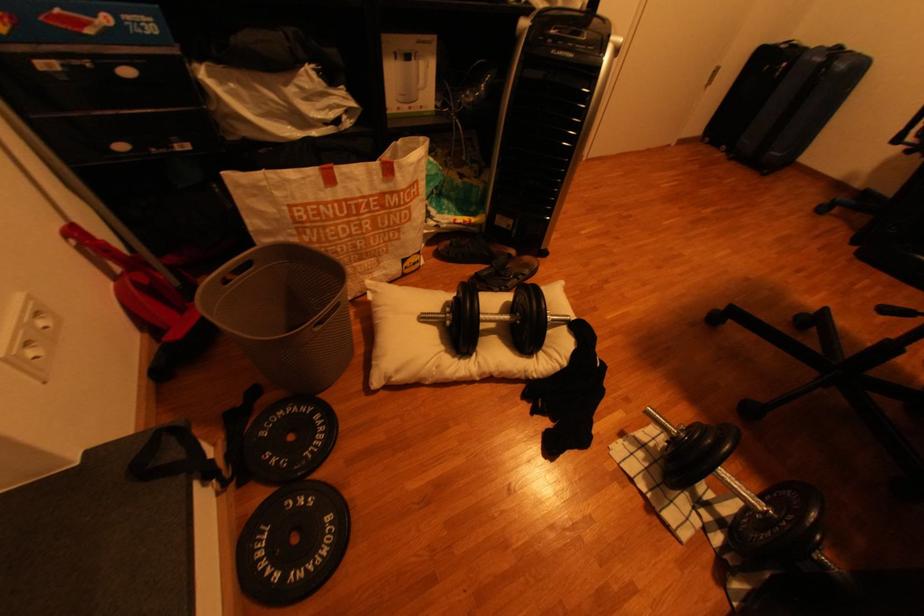
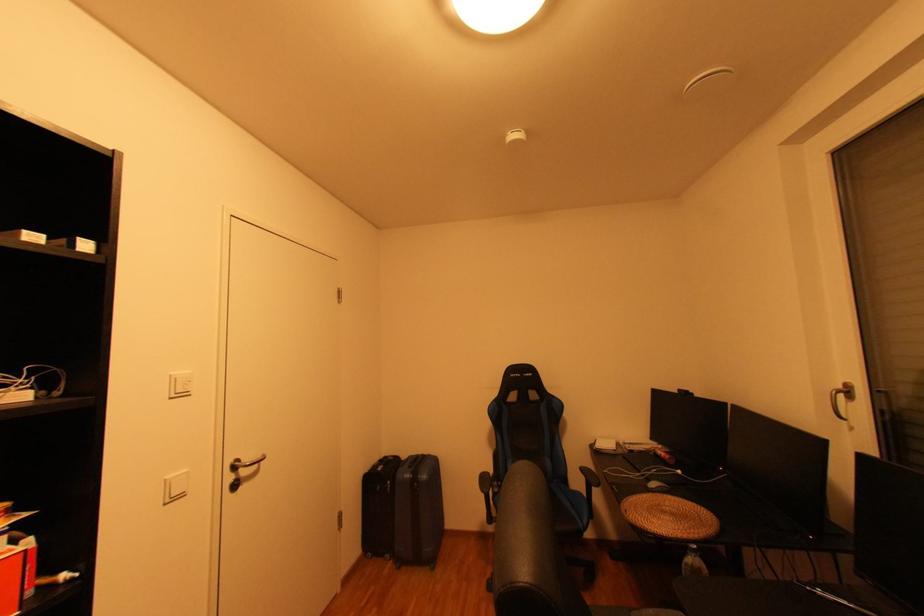
How did the camera likely rotate?

The rotation direction of the camera is right-up.